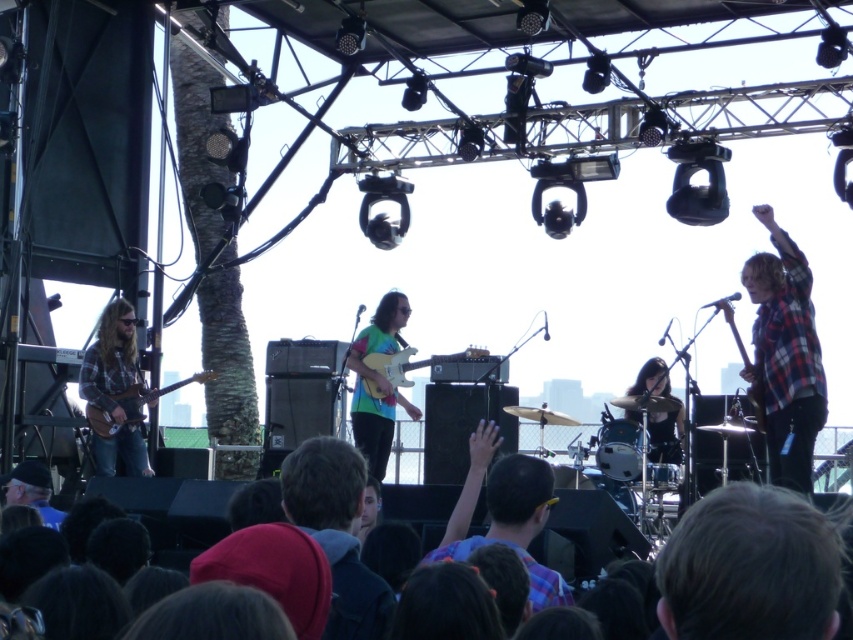
Question: Can you confirm if plaid flannel shirt at right is positioned below plaid fabric shirt at center?

Choices:
 (A) yes
 (B) no

Answer: (B)

Question: Observing the image, what is the correct spatial positioning of plaid fabric shirt at center in reference to shiny black drum set at center?

Choices:
 (A) below
 (B) above

Answer: (A)

Question: Which of the following is the closest to the observer?

Choices:
 (A) rainbow tie-dye shirt at center
 (B) shiny black drum set at center
 (C) plaid flannel shirt at right
 (D) plaid fabric shirt at center

Answer: (D)

Question: Which object appears closest to the camera in this image?

Choices:
 (A) rainbow tie-dye shirt at center
 (B) plaid flannel shirt at right
 (C) plaid fabric shirt at center

Answer: (C)

Question: Which point is farther to the camera?

Choices:
 (A) shiny black drum set at center
 (B) wooden electric guitar at left
 (C) rainbow tie-dye shirt at center
 (D) plaid flannel shirt at right

Answer: (C)

Question: Does plaid flannel shirt at right come in front of shiny black drum set at center?

Choices:
 (A) no
 (B) yes

Answer: (B)